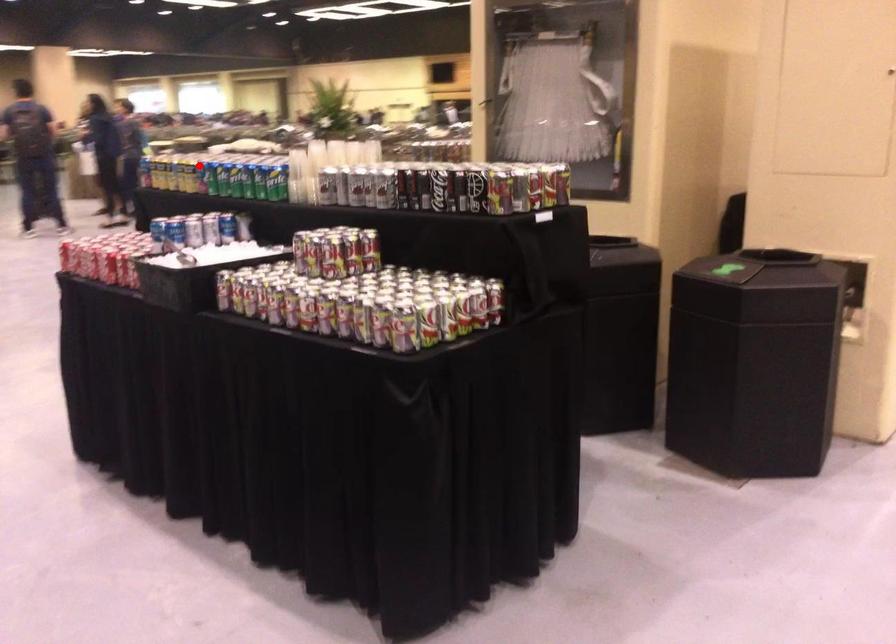
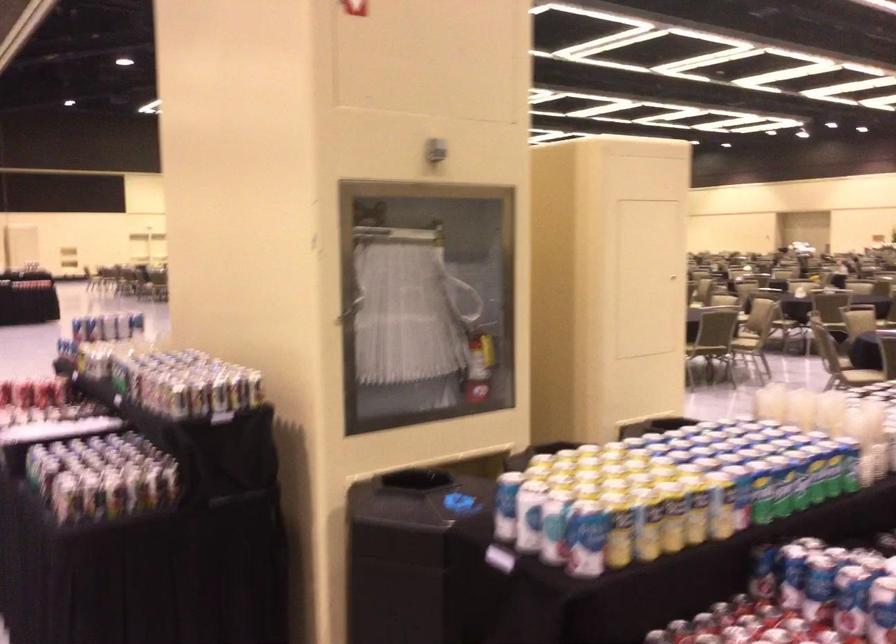
Question: I am providing you with two images of the same scene from different viewpoints. A red point is shown in image1. For the corresponding object point in image2, is it positioned nearer or farther from the camera?

Choices:
 (A) Nearer
 (B) Farther

Answer: (A)